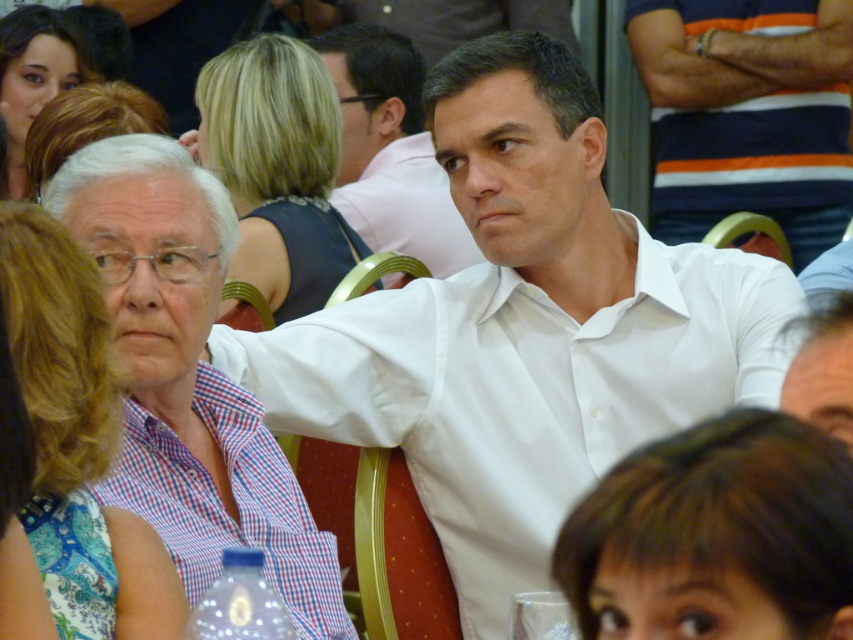
The height and width of the screenshot is (640, 853). What are the coordinates of `matte black hair at upper left` in the screenshot? It's located at (36, 74).

Is the position of matte black hair at upper left less distant than that of transparent glass at lower center?

No, it is not.

Between point (39, 97) and point (521, 630), which one is positioned behind?

The point (39, 97) is more distant.

Where is `matte black hair at upper left`? This screenshot has width=853, height=640. matte black hair at upper left is located at coordinates (36, 74).

Looking at this image, which is below, brown hair at lower right or white cotton shirt at center?

brown hair at lower right is below.

Can you confirm if brown hair at lower right is smaller than white cotton shirt at center?

Yes.

Find the location of `brown hair at lower right`. brown hair at lower right is located at coordinates (721, 529).

Locate an element on the screen. This screenshot has width=853, height=640. brown hair at lower right is located at coordinates (721, 529).

Is point (670, 13) positioned in front of point (560, 602)?

No, it is not.

Is white cotton shirt at center in front of transparent glass at lower center?

No, it is not.

Which is behind, point (733, 106) or point (514, 604)?

Point (733, 106)

At what (x,y) coordinates should I click in order to perform the action: click on white cotton shirt at center. Please return your answer as a coordinate pair (x, y). The height and width of the screenshot is (640, 853). Looking at the image, I should click on click(x=747, y=115).